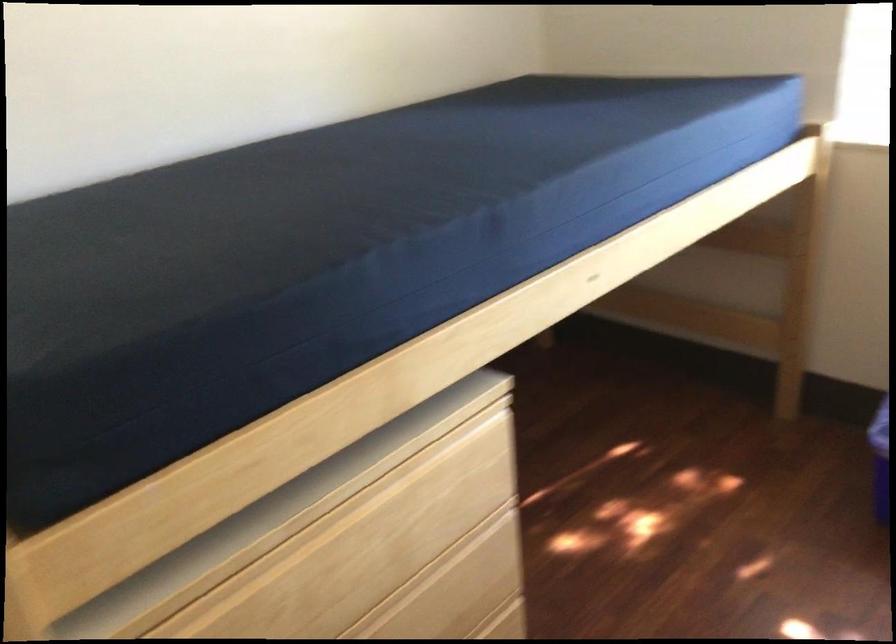
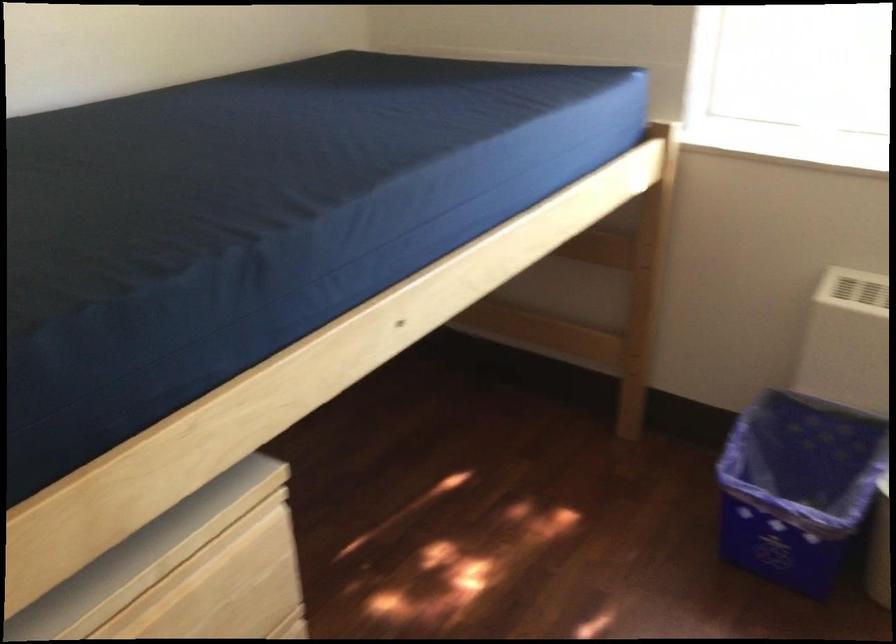
In a continuous first-person perspective shot, in which direction is the camera moving?

The movement direction of the cameraman is right, forward.